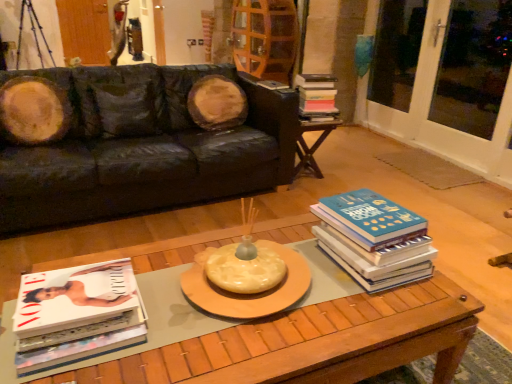
Question: From their relative heights in the image, would you say wooden coffee table at center is taller or shorter than white glass screen door at right, placed as the 2th screen door when sorted from back to front?

Choices:
 (A) short
 (B) tall

Answer: (A)

Question: Visually, is wooden coffee table at center positioned to the left or to the right of white glass screen door at right, placed as the 2th screen door when sorted from back to front?

Choices:
 (A) left
 (B) right

Answer: (A)

Question: Based on their relative distances, which object is nearer to the wooden coffee table at center?

Choices:
 (A) blue hardcover book at right, which is counted as the 2th book, starting from the top
 (B) wooden side table at right
 (C) hardcover book at center, acting as the first book starting from the right
 (D) white glossy magazine at lower left, the first book positioned from the bottom
 (E) wooden screen door at upper left, the 2th screen door from the bottom

Answer: (D)

Question: Estimate the real-world distances between objects in this image. Which object is closer to the blue hardcover book at right, the 2th book positioned from the right?

Choices:
 (A) wooden screen door at upper left, which is the 2th screen door in front-to-back order
 (B) white glass screen door at right, placed as the 2th screen door when sorted from back to front
 (C) white glossy magazine at lower left, marked as the 3th book in a top-to-bottom arrangement
 (D) wooden coffee table at center
 (E) hardcover book at center, acting as the first book starting from the right

Answer: (D)